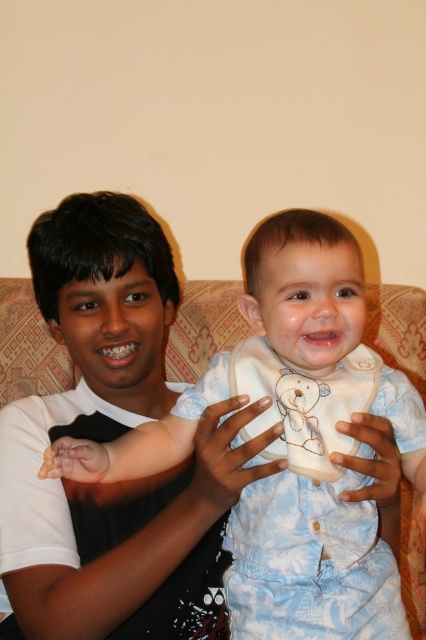
Question: Is white soft bib at center thinner than dark skin hand at center?

Choices:
 (A) yes
 (B) no

Answer: (B)

Question: Which of these objects is positioned closest to the dark skin hand at center?

Choices:
 (A) white matte hand at center
 (B) white soft bib at center

Answer: (A)

Question: Is white soft bib at center positioned before dark skin hand at center?

Choices:
 (A) yes
 (B) no

Answer: (A)

Question: Can you confirm if white soft bib at center is positioned above dark skin hand at center?

Choices:
 (A) no
 (B) yes

Answer: (B)

Question: Which object is the closest to the white soft bib at center?

Choices:
 (A) dark skin hand at center
 (B) white matte hand at center

Answer: (B)

Question: Which point is farther from the camera taking this photo?

Choices:
 (A) (281, 598)
 (B) (385, 461)
 (C) (218, 436)

Answer: (A)